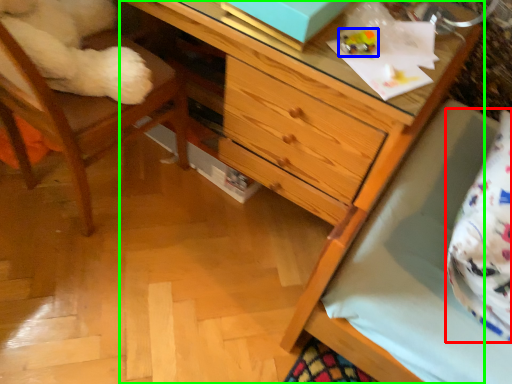
Question: Based on their relative distances, which object is nearer to pillow (highlighted by a red box)? Choose from toy (highlighted by a blue box) and chest of drawers (highlighted by a green box).

Choices:
 (A) toy
 (B) chest of drawers

Answer: (B)